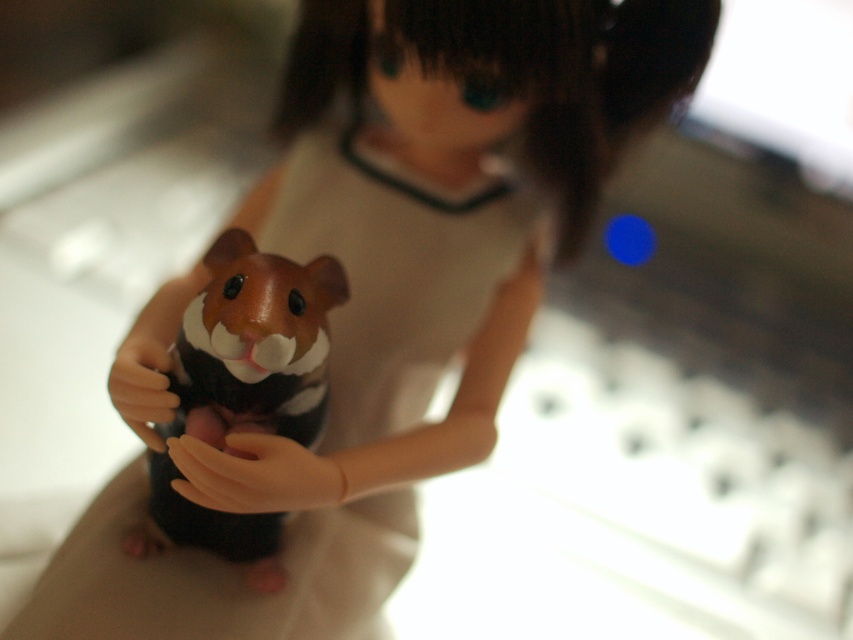
Question: Which point is farther to the camera?

Choices:
 (A) (184, 449)
 (B) (175, 385)

Answer: (B)

Question: Can you confirm if brown matte hamster at center is positioned above smooth beige hand at center?

Choices:
 (A) yes
 (B) no

Answer: (A)

Question: Which of the following is the farthest from the observer?

Choices:
 (A) (227, 438)
 (B) (293, 428)

Answer: (B)

Question: Is brown matte hamster at center bigger than smooth beige hand at center?

Choices:
 (A) no
 (B) yes

Answer: (B)

Question: Which object is closer to the camera taking this photo?

Choices:
 (A) brown matte hamster at center
 (B) smooth beige hand at center

Answer: (B)

Question: Is brown matte hamster at center to the left of smooth beige hand at center from the viewer's perspective?

Choices:
 (A) no
 (B) yes

Answer: (B)